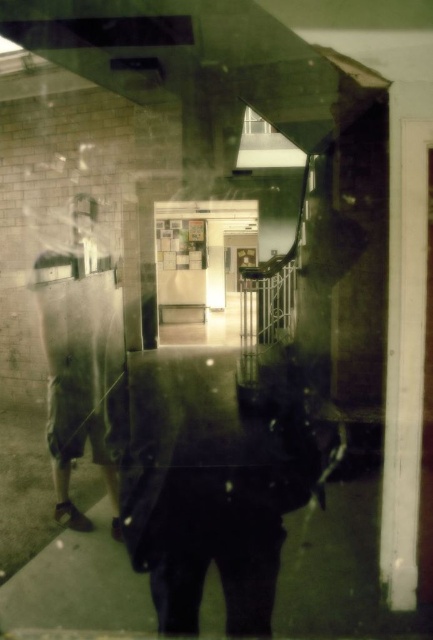
You are a security camera monitoring the hallway and see the dark fabric jacket at center and the matte khaki shorts at left. Which object is closer to the camera?

The dark fabric jacket at center is closer to the camera because it is in front of the matte khaki shorts at left.

You are a security camera monitoring the hallway. You notice two items in the scene, the dark fabric jacket at center and the matte khaki shorts at left. Which item is closer to the camera?

The dark fabric jacket at center is closer to the camera because it is positioned under the matte khaki shorts at left, indicating it is in a lower plane and thus nearer to the observer.

You are standing in the hallway and see the dark fabric jacket at center and the matte khaki shorts at left. Which one is closer to the entrance of the hallway?

The dark fabric jacket at center is closer to the entrance of the hallway because it is positioned to the right of the matte khaki shorts at left, which would be further away from the entrance.